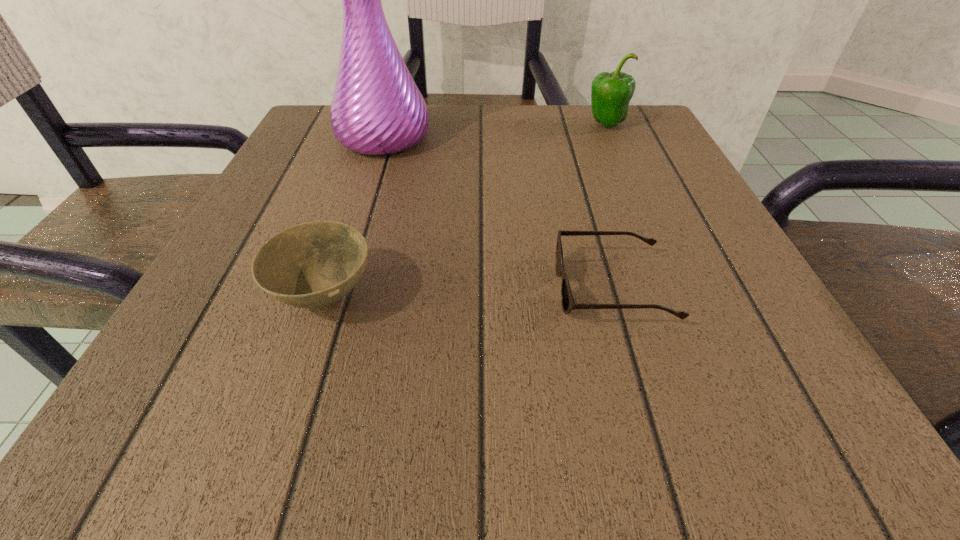
Image resolution: width=960 pixels, height=540 pixels. In order to click on free point that satisfies the following two spatial constraints: 1. on the back side of the second tallest object; 2. on the left side of the vase in this screenshot , I will do `click(388, 124)`.